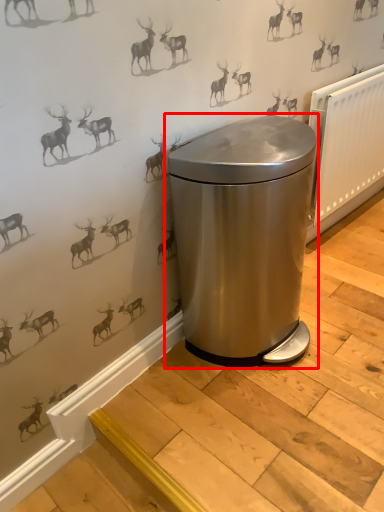
Question: From the image's perspective, where is waste container (annotated by the red box) located in relation to radiator in the image?

Choices:
 (A) above
 (B) below

Answer: (B)